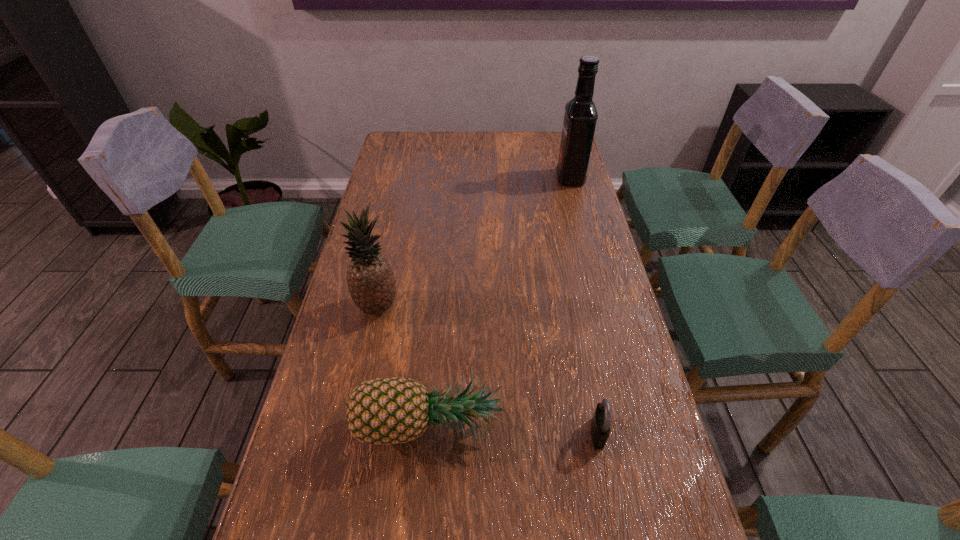
You are a GUI agent. You are given a task and a screenshot of the screen. Output one action in this format:
    pyautogui.click(x=<x>, y=<y>)
    Task: Click on the vacant space situated 0.260m on the front-facing side of the farthest object
    The height and width of the screenshot is (540, 960).
    Given the screenshot: What is the action you would take?
    pyautogui.click(x=484, y=178)

At what (x,y) coordinates should I click in order to perform the action: click on vacant point located 0.380m on the front of the taller pineapple. Please return your answer as a coordinate pair (x, y). Looking at the image, I should click on (340, 480).

Identify the location of free point located 0.210m on the right of the third tallest object. This screenshot has height=540, width=960. (603, 424).

Where is `free spot located on the left of the third object from left to right`? free spot located on the left of the third object from left to right is located at coordinates (464, 433).

You are a GUI agent. You are given a task and a screenshot of the screen. Output one action in this format:
    pyautogui.click(x=<x>, y=<y>)
    Task: Click on the liquor that is at the right edge
    The width and height of the screenshot is (960, 540).
    Given the screenshot: What is the action you would take?
    pyautogui.click(x=580, y=117)

This screenshot has height=540, width=960. What are the coordinates of `padlock present at the right edge` in the screenshot? It's located at [x=600, y=426].

In the image, there is a desktop. In order to click on vacant region at the far edge in this screenshot , I will do `click(501, 147)`.

Identify the location of vacant region at the left edge. (340, 376).

The width and height of the screenshot is (960, 540). In the image, there is a desktop. What are the coordinates of `free space at the right edge` in the screenshot? It's located at (574, 190).

Locate an element on the screen. Image resolution: width=960 pixels, height=540 pixels. vacant area between the rightmost object and the second tallest object is located at coordinates (474, 242).